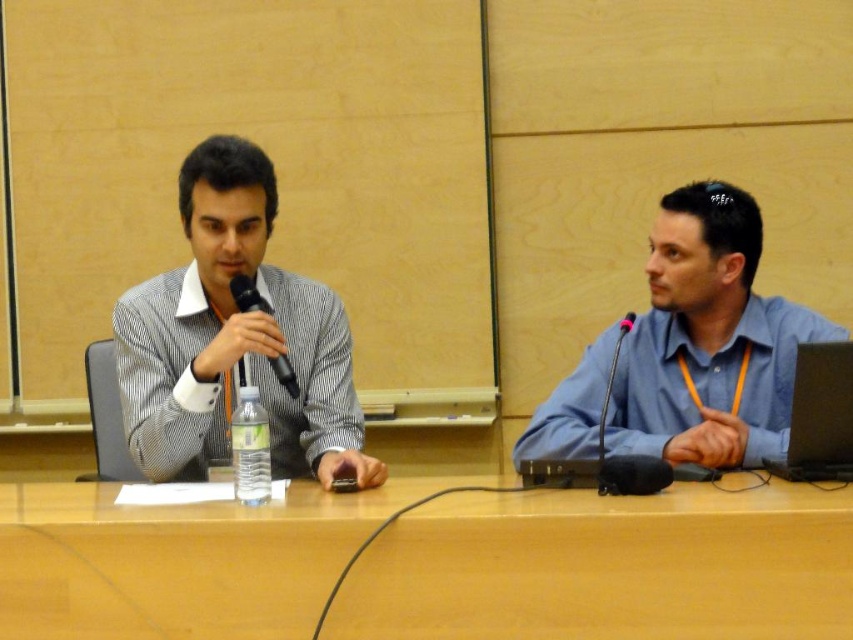
Question: Does striped fabric shirt at left have a lesser width compared to clear plastic bottle at center?

Choices:
 (A) no
 (B) yes

Answer: (A)

Question: Which point appears farthest from the camera in this image?

Choices:
 (A) (838, 438)
 (B) (178, 572)

Answer: (A)

Question: Can you confirm if striped fabric shirt at left is positioned to the right of black rubber microphone at right?

Choices:
 (A) no
 (B) yes

Answer: (A)

Question: Among these points, which one is farthest from the camera?

Choices:
 (A) (651, 589)
 (B) (242, 282)
 (C) (518, 451)
 (D) (598, 435)

Answer: (C)

Question: Is wooden at center bigger than striped fabric shirt at left?

Choices:
 (A) yes
 (B) no

Answer: (A)

Question: Which of the following is the closest to the observer?

Choices:
 (A) 241,420
 (B) 202,262
 (C) 834,410
 (D) 273,360

Answer: (A)